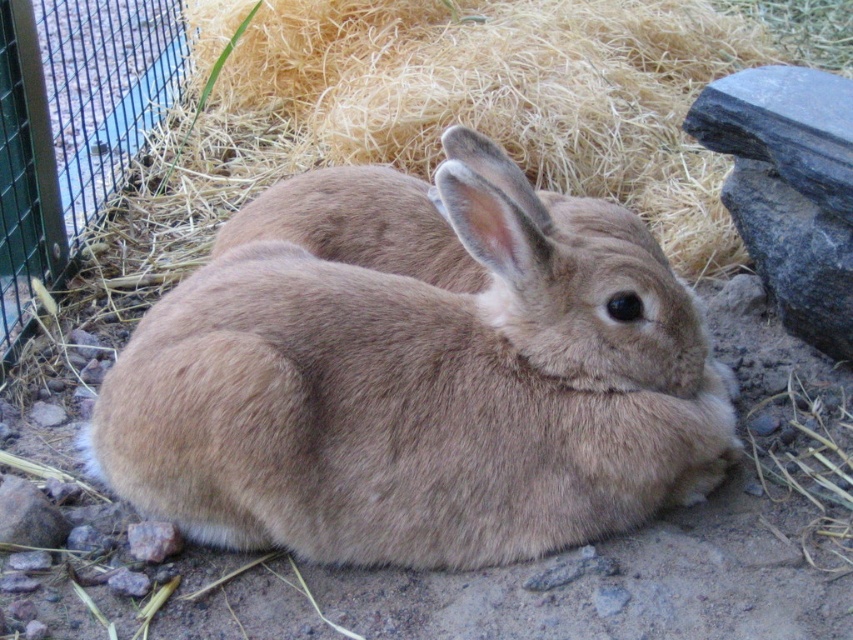
Question: Is fuzzy brown rabbit at center bigger than brown soft hay at center?

Choices:
 (A) no
 (B) yes

Answer: (A)

Question: Which object appears farthest from the camera in this image?

Choices:
 (A) fuzzy brown rabbit at center
 (B) brown soft hay at center

Answer: (B)

Question: Is fuzzy brown rabbit at center to the right of brown soft hay at center from the viewer's perspective?

Choices:
 (A) yes
 (B) no

Answer: (B)

Question: Does fuzzy brown rabbit at center have a greater width compared to brown soft hay at center?

Choices:
 (A) no
 (B) yes

Answer: (A)